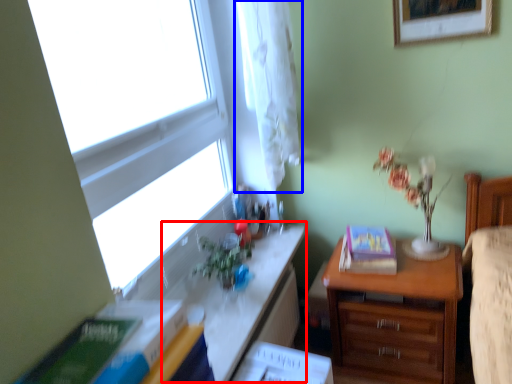
Question: Which object appears closest to the camera in this image, table (highlighted by a red box) or curtain (highlighted by a blue box)?

Choices:
 (A) table
 (B) curtain

Answer: (A)